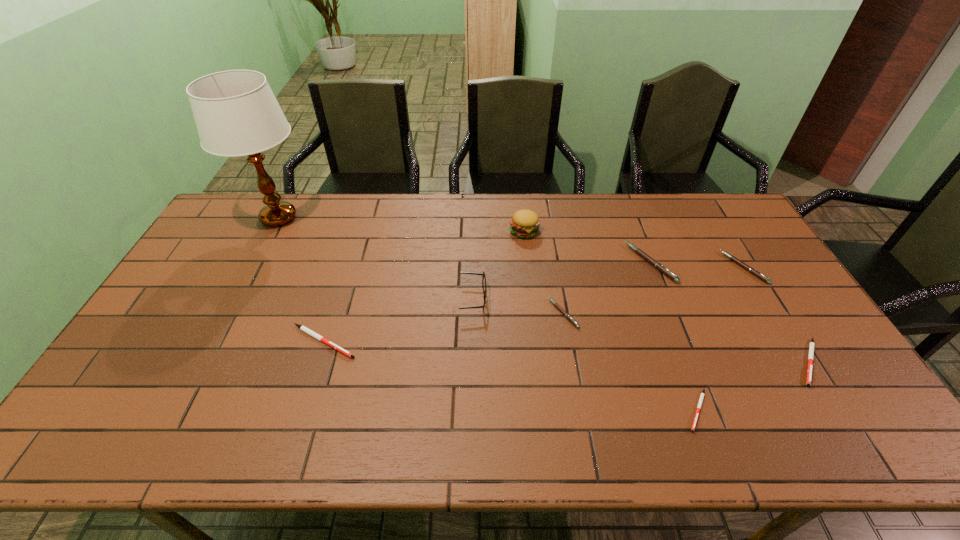
What are the coordinates of `hamburger at the far edge` in the screenshot? It's located at (525, 223).

Locate an element on the screen. Image resolution: width=960 pixels, height=540 pixels. object that is at the near edge is located at coordinates (702, 394).

Identify the location of object that is at the left edge. (236, 113).

At what (x,y) coordinates should I click in order to perform the action: click on object that is at the far left corner. Please return your answer as a coordinate pair (x, y). This screenshot has height=540, width=960. Looking at the image, I should click on (236, 113).

You are a GUI agent. You are given a task and a screenshot of the screen. Output one action in this format:
    pyautogui.click(x=<x>, y=<y>)
    Task: Click on the free space at the far edge of the desktop
    
    Given the screenshot: What is the action you would take?
    pyautogui.click(x=579, y=219)

At what (x,y) coordinates should I click in order to perform the action: click on vacant position at the near edge of the desktop. Please return your answer as a coordinate pair (x, y). Image resolution: width=960 pixels, height=540 pixels. Looking at the image, I should click on click(x=156, y=437).

Where is `vacant region at the left edge of the desktop`? The image size is (960, 540). vacant region at the left edge of the desktop is located at coordinates (93, 408).

The image size is (960, 540). Find the location of `free space at the right edge`. free space at the right edge is located at coordinates (763, 261).

I want to click on vacant space at the far left corner of the desktop, so click(x=244, y=224).

In the image, there is a desktop. Find the location of `vacant space at the near left corner`. vacant space at the near left corner is located at coordinates (110, 426).